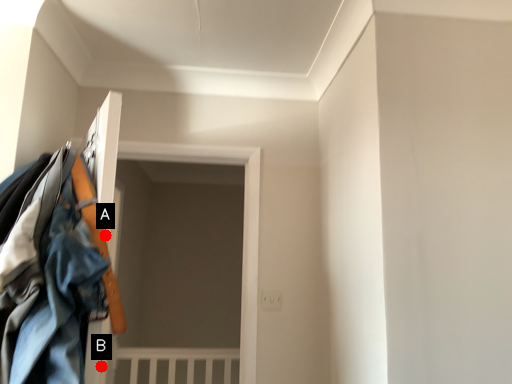
Question: Two points are circled on the image, labeled by A and B beside each circle. Among these points, which one is nearest to the camera?

Choices:
 (A) A is closer
 (B) B is closer

Answer: (B)